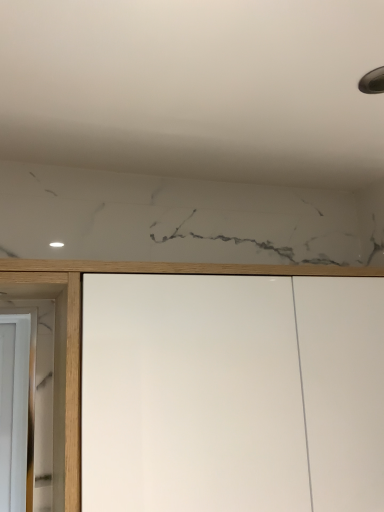
Image resolution: width=384 pixels, height=512 pixels. What do you see at coordinates (191, 395) in the screenshot? I see `white glossy screen door at upper center` at bounding box center [191, 395].

Find the location of `white glossy screen door at upper center`. white glossy screen door at upper center is located at coordinates (191, 395).

Identify the location of white glossy screen door at upper center. (191, 395).